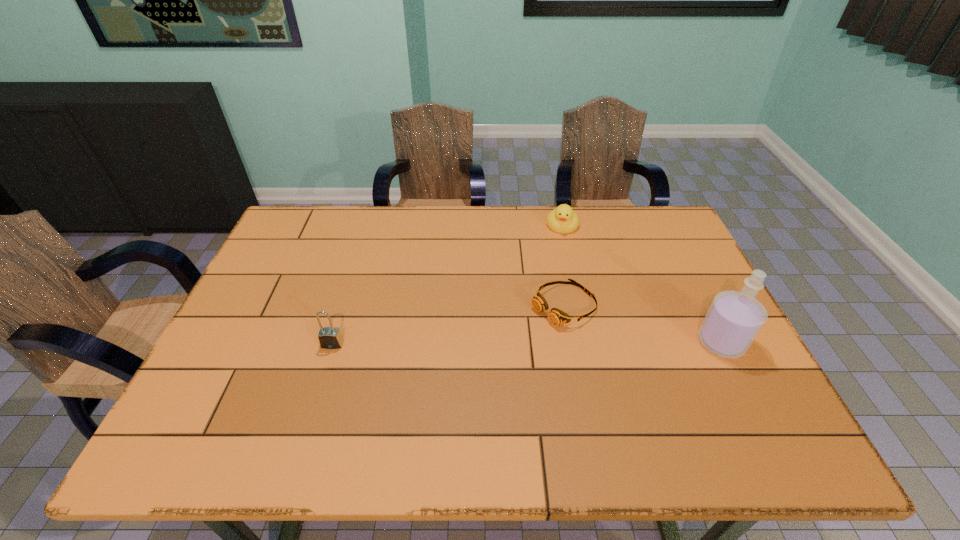
Identify the location of empty space between the rightmost object and the shortest object. (642, 323).

This screenshot has height=540, width=960. Identify the location of empty space between the goggles and the farthest object. (563, 265).

I want to click on object that is the third closest to the third shortest object, so click(734, 319).

Select which object is the third closest to the shortest object. Please provide its 2D coordinates. Your answer should be formatted as a tuple, i.e. [(x, y)], where the tuple contains the x and y coordinates of a point satisfying the conditions above.

[(329, 337)]

Identify the location of free spot that satisfies the following two spatial constraints: 1. on the back side of the goggles; 2. on the right side of the third tallest object. This screenshot has width=960, height=540. 548,225.

The height and width of the screenshot is (540, 960). What are the coordinates of `vacant space that satisfies the following two spatial constraints: 1. on the front side of the farthest object; 2. on the left side of the rightmost object` in the screenshot? It's located at (588, 342).